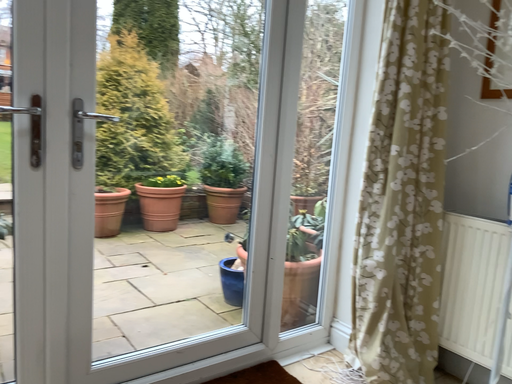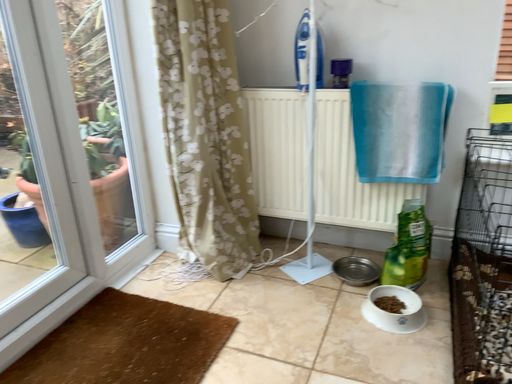
Question: How did the camera likely rotate when shooting the video?

Choices:
 (A) rotated downward
 (B) rotated upward

Answer: (A)